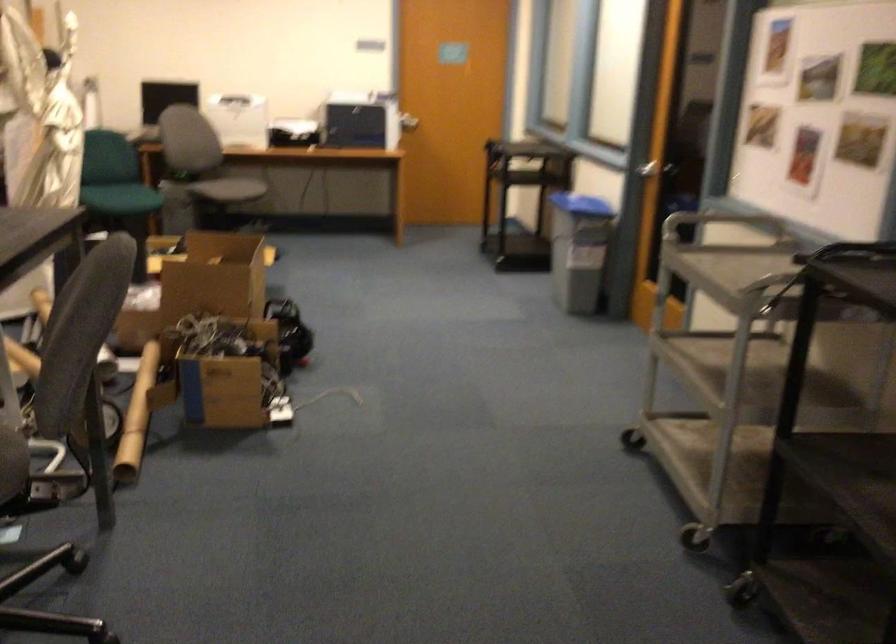
Identify the location of green chair sitting surface. (119, 200).